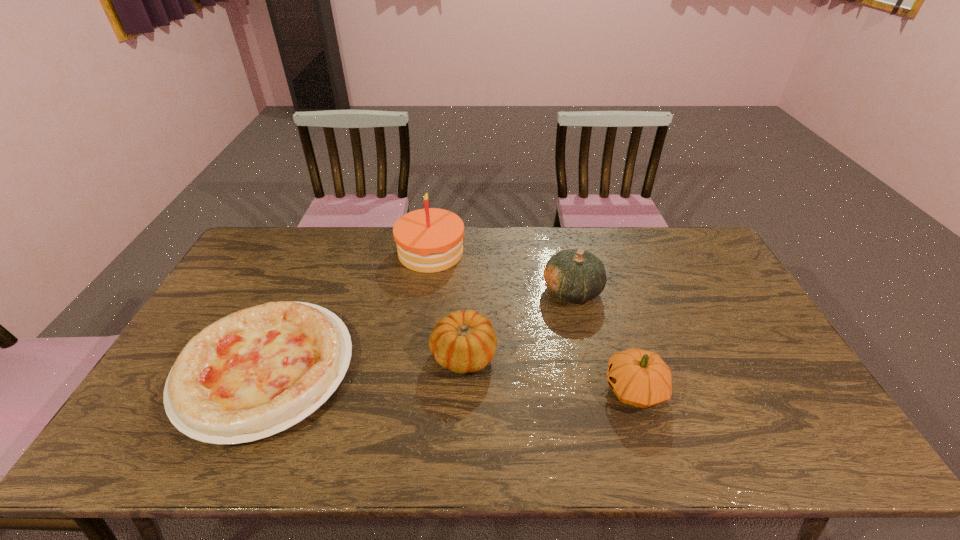
This screenshot has width=960, height=540. I want to click on the tallest object, so click(x=429, y=240).

Where is `the farthest gourd`? The image size is (960, 540). the farthest gourd is located at coordinates (574, 275).

Where is `the leftmost gourd`? This screenshot has height=540, width=960. the leftmost gourd is located at coordinates (464, 341).

I want to click on pizza, so [254, 373].

Image resolution: width=960 pixels, height=540 pixels. In order to click on the leftmost object in this screenshot , I will do `click(254, 373)`.

Identify the location of free location located on the right of the tallest object. (501, 252).

Image resolution: width=960 pixels, height=540 pixels. Identify the location of vacant space located on the left of the farthest gourd. (480, 291).

You are a GUI agent. You are given a task and a screenshot of the screen. Output one action in this format:
    pyautogui.click(x=<x>, y=<y>)
    Task: Click on the blank space located 0.140m on the front of the leftmost gourd
    Image resolution: width=960 pixels, height=540 pixels.
    Given the screenshot: What is the action you would take?
    pyautogui.click(x=461, y=431)

Where is `blank area located on the right of the pizza`? blank area located on the right of the pizza is located at coordinates (x=393, y=369).

Where is `object that is at the far edge`? Image resolution: width=960 pixels, height=540 pixels. object that is at the far edge is located at coordinates (429, 240).